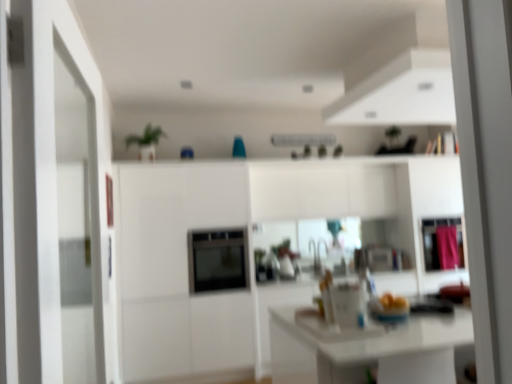
Question: Can you confirm if pink fabric curtain at right is smaller than satin black oven at center?

Choices:
 (A) yes
 (B) no

Answer: (A)

Question: Considering the relative positions of pink fabric curtain at right and satin black oven at center in the image provided, is pink fabric curtain at right to the right of satin black oven at center from the viewer's perspective?

Choices:
 (A) no
 (B) yes

Answer: (B)

Question: Is pink fabric curtain at right bigger than satin black oven at center?

Choices:
 (A) no
 (B) yes

Answer: (A)

Question: Can you confirm if pink fabric curtain at right is thinner than satin black oven at center?

Choices:
 (A) no
 (B) yes

Answer: (B)

Question: Is pink fabric curtain at right positioned with its back to satin black oven at center?

Choices:
 (A) yes
 (B) no

Answer: (B)

Question: From a real-world perspective, is pink fabric curtain at right above or below pink fabric cabinet at right?

Choices:
 (A) below
 (B) above

Answer: (A)

Question: Is pink fabric curtain at right inside the boundaries of pink fabric cabinet at right, or outside?

Choices:
 (A) inside
 (B) outside

Answer: (A)

Question: Is pink fabric curtain at right taller or shorter than pink fabric cabinet at right?

Choices:
 (A) short
 (B) tall

Answer: (A)

Question: From the image's perspective, relative to pink fabric cabinet at right, is pink fabric curtain at right above or below?

Choices:
 (A) below
 (B) above

Answer: (A)

Question: In terms of width, does pink fabric cabinet at right look wider or thinner when compared to satin black oven at center?

Choices:
 (A) wide
 (B) thin

Answer: (B)

Question: Visually, is pink fabric cabinet at right positioned to the left or to the right of satin black oven at center?

Choices:
 (A) right
 (B) left

Answer: (A)

Question: Do you think pink fabric cabinet at right is within satin black oven at center, or outside of it?

Choices:
 (A) outside
 (B) inside

Answer: (A)

Question: From the image's perspective, relative to satin black oven at center, is pink fabric cabinet at right above or below?

Choices:
 (A) below
 (B) above

Answer: (B)

Question: Considering the positions of point (437, 218) and point (445, 236), is point (437, 218) closer or farther from the camera than point (445, 236)?

Choices:
 (A) farther
 (B) closer

Answer: (A)

Question: From the image's perspective, is pink fabric cabinet at right positioned above or below pink fabric curtain at right?

Choices:
 (A) below
 (B) above

Answer: (B)